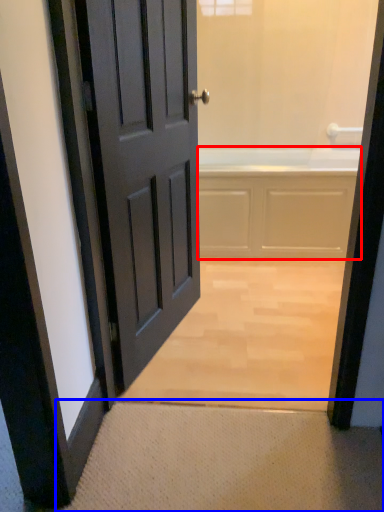
Question: Which object appears farthest to the camera in this image, bath (highlighted by a red box) or doormat (highlighted by a blue box)?

Choices:
 (A) bath
 (B) doormat

Answer: (A)